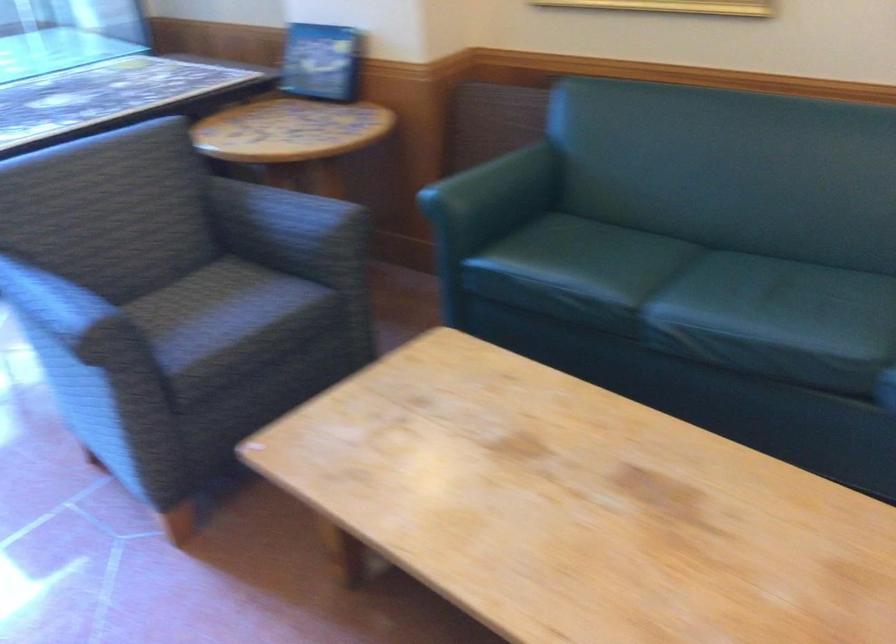
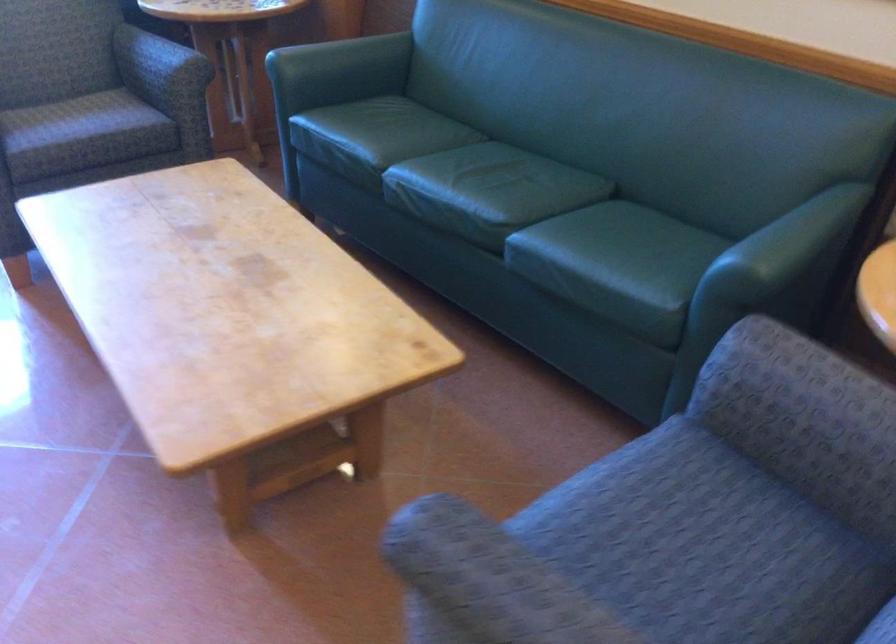
The point at [216,321] is marked in the first image. Where is the corresponding point in the second image?

(65, 118)